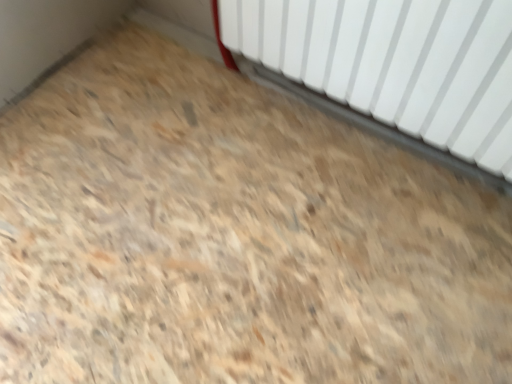
This screenshot has height=384, width=512. Describe the element at coordinates (395, 63) in the screenshot. I see `white textured curtain at upper right` at that location.

Where is `white textured curtain at upper right`? Image resolution: width=512 pixels, height=384 pixels. white textured curtain at upper right is located at coordinates (395, 63).

Measure the distance between point (346,18) and camera.

Point (346,18) and camera are 1.12 meters apart from each other.

You are a GUI agent. You are given a task and a screenshot of the screen. Output one action in this format:
    pyautogui.click(x=<x>, y=<y>)
    Task: Click on the white textured curtain at upper right
    The height and width of the screenshot is (384, 512).
    Given the screenshot: What is the action you would take?
    pyautogui.click(x=395, y=63)